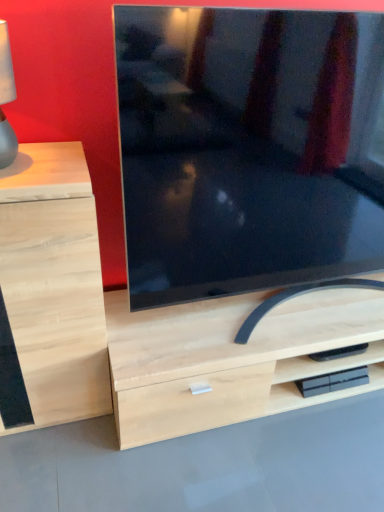
Question: Is point (11, 142) closer or farther from the camera than point (268, 282)?

Choices:
 (A) farther
 (B) closer

Answer: (B)

Question: Is matte gray lampshade at left taller or shorter than matte black tv at center?

Choices:
 (A) tall
 (B) short

Answer: (B)

Question: Which object is the farthest from the matte black tv at center?

Choices:
 (A) light wood drawer at left
 (B) matte gray lampshade at left

Answer: (B)

Question: Which object is positioned farthest from the light wood drawer at left?

Choices:
 (A) matte black tv at center
 (B) matte gray lampshade at left

Answer: (A)